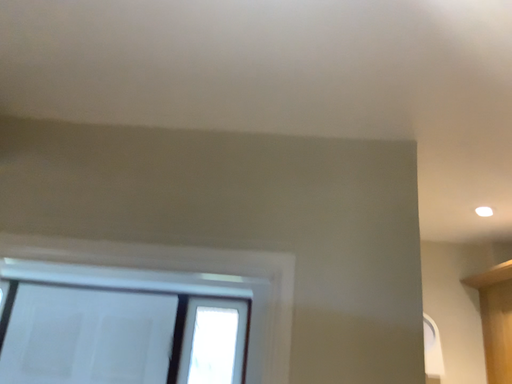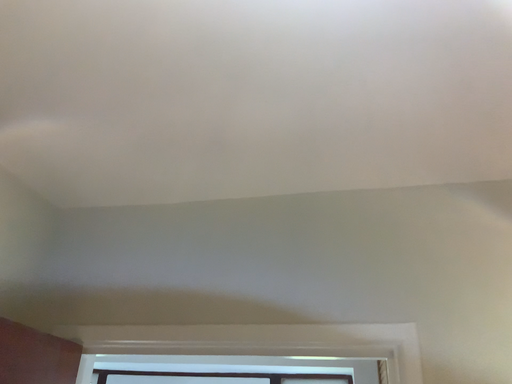
Question: How did the camera likely rotate when shooting the video?

Choices:
 (A) rotated downward
 (B) rotated upward

Answer: (B)